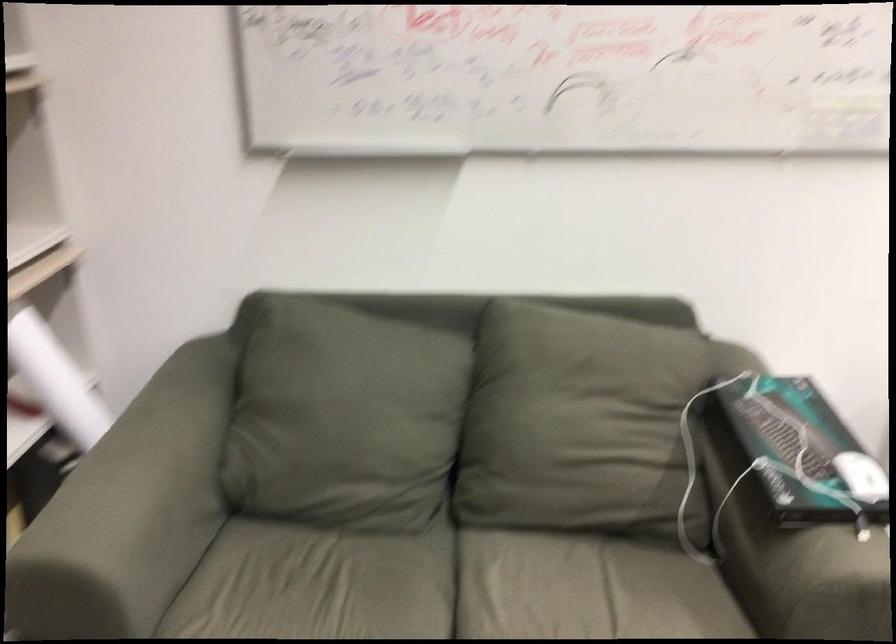
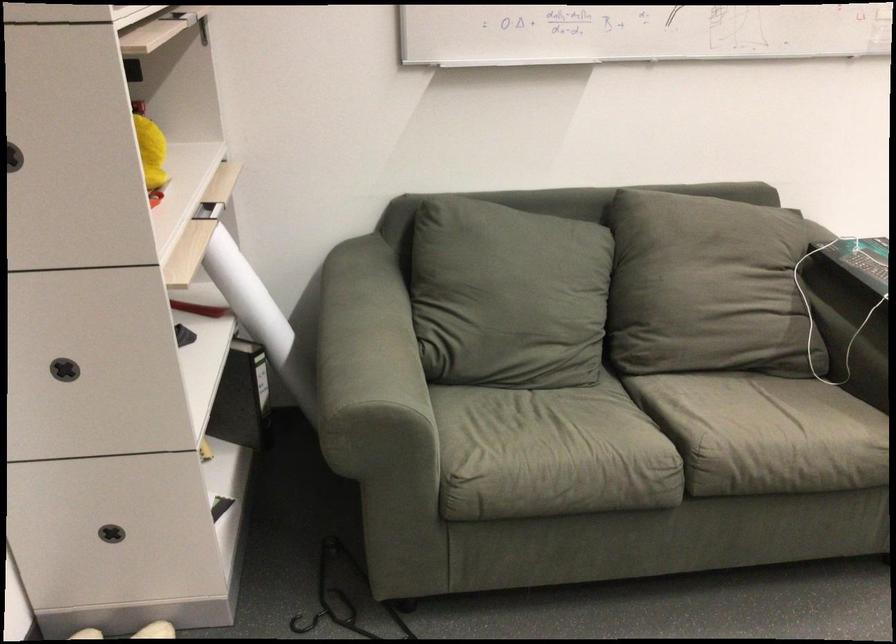
Where in the second image is the point corresponding to point 752,410 from the first image?

(860, 259)